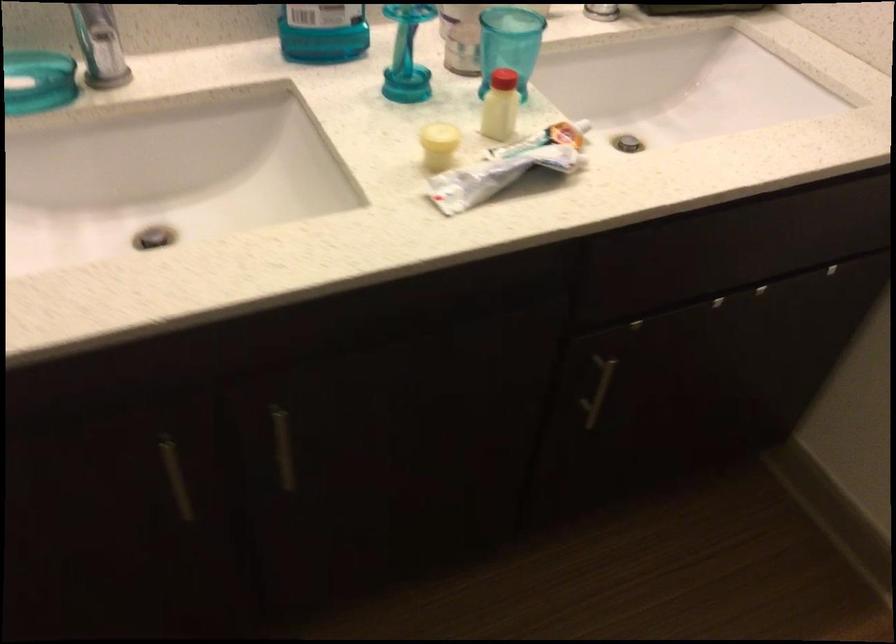
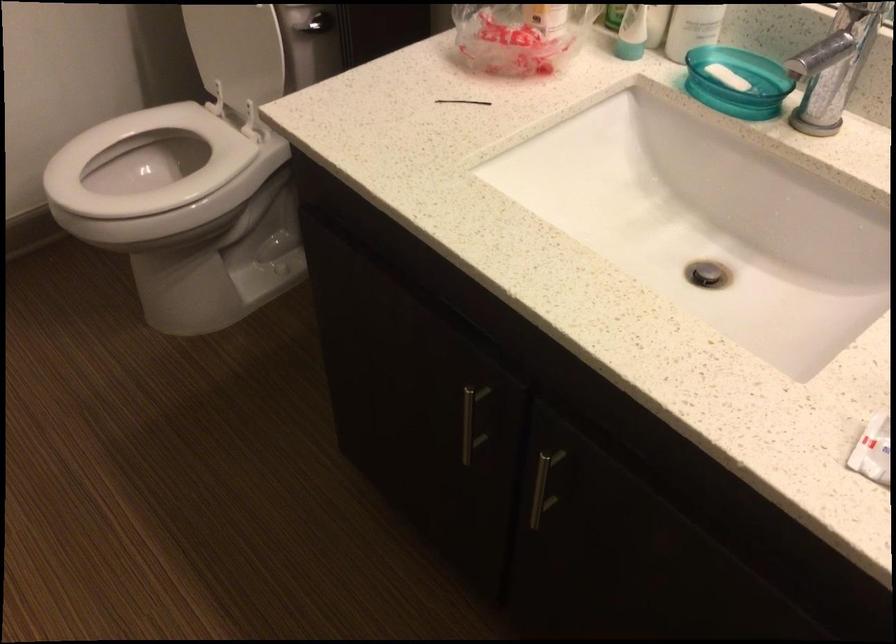
Locate, in the second image, the point that corresponds to point (274, 448) in the first image.

(543, 486)